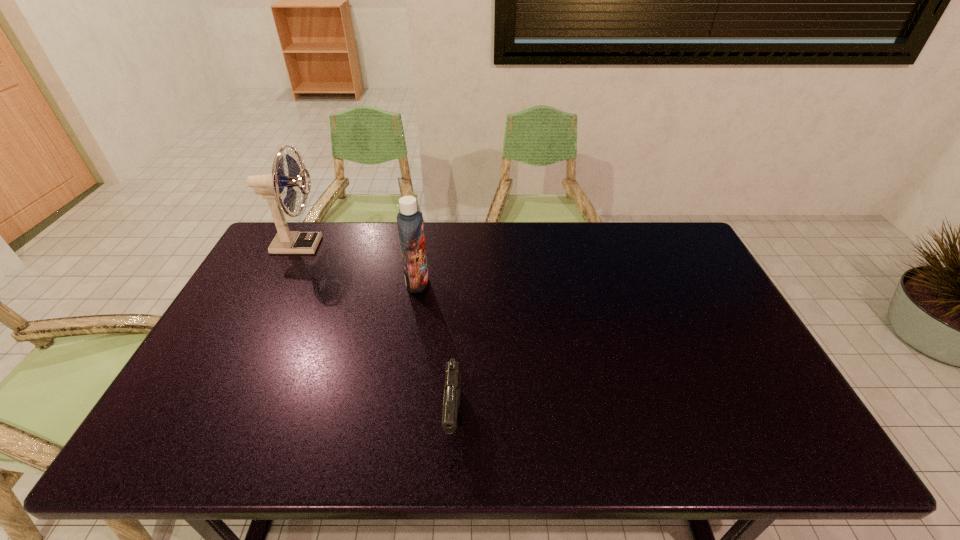
This screenshot has width=960, height=540. Identify the location of object situated at the left edge. (270, 186).

You are a GUI agent. You are given a task and a screenshot of the screen. Output one action in this format:
    pyautogui.click(x=<x>, y=<y>)
    Task: Click on the object at the far left corner
    
    Given the screenshot: What is the action you would take?
    pyautogui.click(x=270, y=186)

The height and width of the screenshot is (540, 960). I want to click on vacant space at the far edge, so click(370, 227).

Locate an element on the screen. vacant space at the near edge is located at coordinates (283, 427).

The width and height of the screenshot is (960, 540). What are the coordinates of `blank space at the left edge of the desktop` in the screenshot? It's located at (239, 326).

Find the location of a particular element. The image size is (960, 540). vacant space at the right edge of the desktop is located at coordinates (686, 264).

Find the location of a particular element. vacant region at the near left corner of the desktop is located at coordinates (203, 430).

In order to click on vacant area between the pistol and the shampoo in this screenshot , I will do `click(436, 350)`.

At what (x,y) coordinates should I click in order to perform the action: click on free space between the tallest object and the second nearest object. Please return your answer as a coordinate pair (x, y). Looking at the image, I should click on (358, 264).

Where is `vacant area that lies between the leftmost object and the second tallest object`? This screenshot has width=960, height=540. vacant area that lies between the leftmost object and the second tallest object is located at coordinates (358, 264).